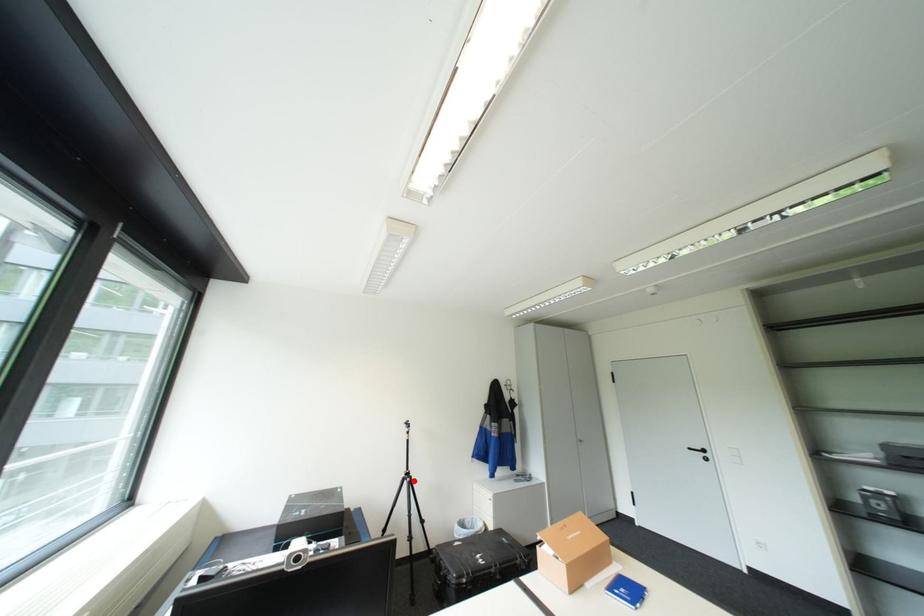
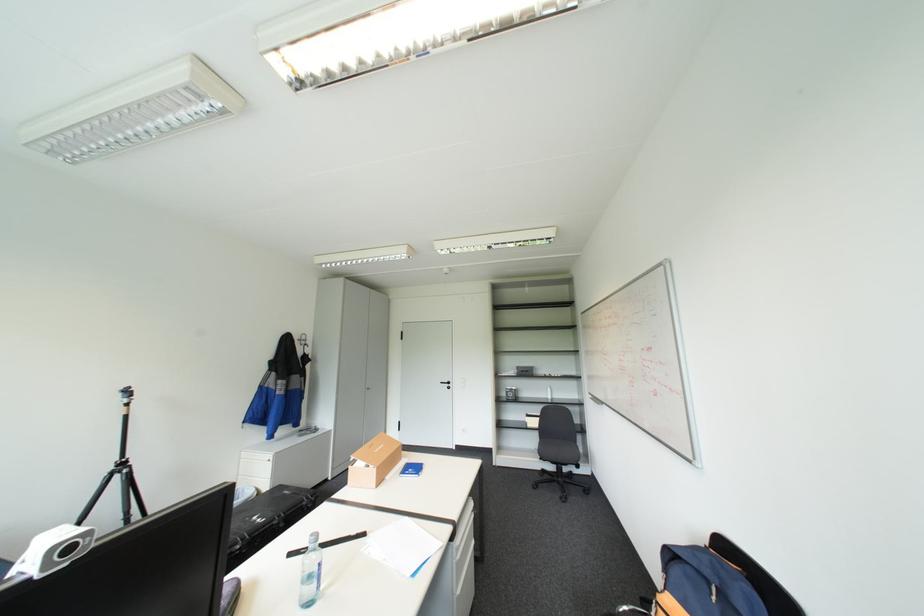
Question: I am providing you with two images of the same scene from different viewpoints. A red point is marked on the first image. Is the red point's position out of view in image 2?

Choices:
 (A) Yes
 (B) No

Answer: (B)